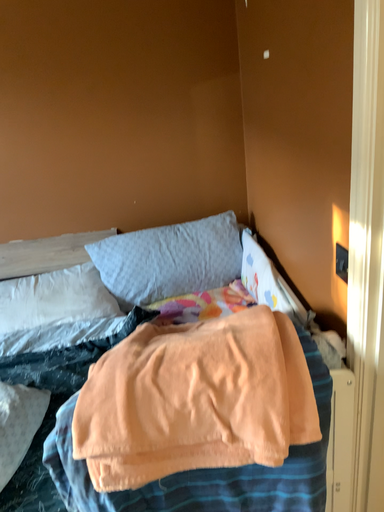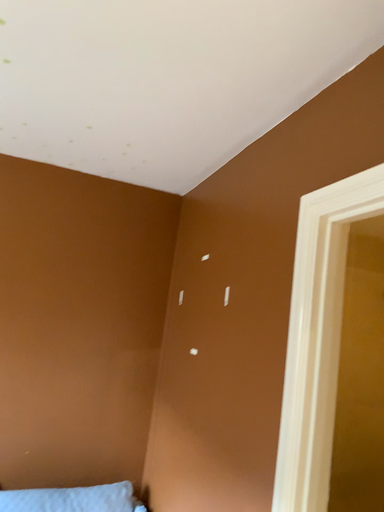
Question: Which way did the camera rotate in the video?

Choices:
 (A) rotated right
 (B) rotated left

Answer: (A)